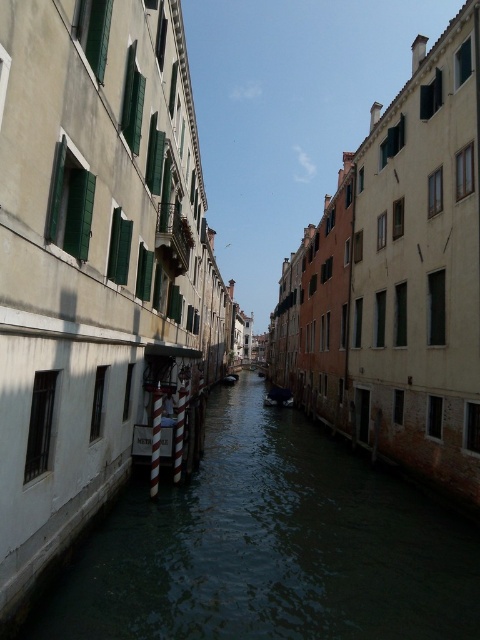
Is greenish water at center shorter than shiny blue boat at center?

Yes.

Is greenish water at center behind shiny blue boat at center?

No, greenish water at center is in front of shiny blue boat at center.

You are a GUI agent. You are given a task and a screenshot of the screen. Output one action in this format:
    pyautogui.click(x=<x>, y=<y>)
    Task: Click on the greenish water at center
    The height and width of the screenshot is (640, 480).
    Given the screenshot: What is the action you would take?
    pyautogui.click(x=271, y=547)

Where is `greenish water at center`? This screenshot has width=480, height=640. greenish water at center is located at coordinates (271, 547).